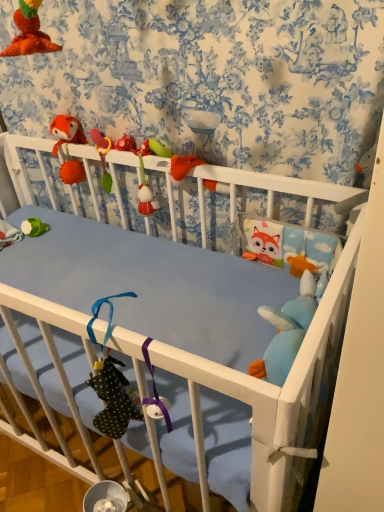
Measure the distance between soft plush toy at right, the 1th toy positioned from the bottom, and camera.

The depth of soft plush toy at right, the 1th toy positioned from the bottom, is 99.75 centimeters.

The height and width of the screenshot is (512, 384). I want to click on soft plush toy at right, the second toy viewed from the left, so click(x=309, y=271).

What do you see at coordinates (309, 271) in the screenshot? I see `soft plush toy at right, which is the first toy from front to back` at bounding box center [309, 271].

I want to click on fluffy orange fox at upper left, the 2th toy from the front, so click(66, 131).

Measure the distance between point (52, 131) and camera.

A distance of 1.32 meters exists between point (52, 131) and camera.

What do you see at coordinates (66, 131) in the screenshot? I see `fluffy orange fox at upper left, which is counted as the second toy, starting from the right` at bounding box center [66, 131].

At what (x,y) coordinates should I click in order to perform the action: click on soft plush toy at right, the 1th toy positioned from the bottom. Please return your answer as a coordinate pair (x, y). The image size is (384, 512). Looking at the image, I should click on (309, 271).

Is soft plush toy at right, which is the first toy from front to back, to the right of fluffy orange fox at upper left, positioned as the 1th toy in left-to-right order, from the viewer's perspective?

Yes.

Which object is closer to the camera taking this photo, soft plush toy at right, the 1th toy positioned from the bottom, or fluffy orange fox at upper left, the 2th toy from the front?

Positioned in front is soft plush toy at right, the 1th toy positioned from the bottom.

Which is nearer, (313, 276) or (60, 177)?

Point (313, 276) is positioned closer to the camera compared to point (60, 177).

From the image's perspective, does soft plush toy at right, which ranks as the 2th toy in top-to-bottom order, appear lower than fluffy orange fox at upper left, the 2th toy from the front?

Yes, from the image's perspective, soft plush toy at right, which ranks as the 2th toy in top-to-bottom order, is below fluffy orange fox at upper left, the 2th toy from the front.

From a real-world perspective, is soft plush toy at right, which is the first toy from front to back, under fluffy orange fox at upper left, the first toy positioned from the back?

Correct, in the physical world, soft plush toy at right, which is the first toy from front to back, is lower than fluffy orange fox at upper left, the first toy positioned from the back.

Which object is thinner, soft plush toy at right, which is the first toy from front to back, or fluffy orange fox at upper left, the 2th toy from the front?

fluffy orange fox at upper left, the 2th toy from the front, is thinner.

Can you confirm if soft plush toy at right, which ranks as the 2th toy in top-to-bottom order, is taller than fluffy orange fox at upper left, the 1th toy when ordered from top to bottom?

No, soft plush toy at right, which ranks as the 2th toy in top-to-bottom order, is not taller than fluffy orange fox at upper left, the 1th toy when ordered from top to bottom.

Who is smaller, soft plush toy at right, the 1th toy in the right-to-left sequence, or fluffy orange fox at upper left, positioned as the second toy in bottom-to-top order?

With smaller size is soft plush toy at right, the 1th toy in the right-to-left sequence.

Is soft plush toy at right, the 1th toy positioned from the bottom, outside of fluffy orange fox at upper left, positioned as the second toy in bottom-to-top order?

soft plush toy at right, the 1th toy positioned from the bottom, is positioned outside fluffy orange fox at upper left, positioned as the second toy in bottom-to-top order.

Is soft plush toy at right, the 1th toy in the right-to-left sequence, placed right next to fluffy orange fox at upper left, the 1th toy when ordered from top to bottom?

They are not placed beside each other.

Is soft plush toy at right, the 1th toy positioned from the bottom, positioned with its back to fluffy orange fox at upper left, the 2th toy from the front?

soft plush toy at right, the 1th toy positioned from the bottom, is not turned away from fluffy orange fox at upper left, the 2th toy from the front.

What's the angular difference between soft plush toy at right, placed as the second toy when sorted from back to front, and fluffy orange fox at upper left, the 2th toy from the front,'s facing directions?

soft plush toy at right, placed as the second toy when sorted from back to front, and fluffy orange fox at upper left, the 2th toy from the front, are facing 90.2 degrees away from each other.

How distant is soft plush toy at right, the 1th toy positioned from the bottom, from fluffy orange fox at upper left, the first toy positioned from the back?

The distance of soft plush toy at right, the 1th toy positioned from the bottom, from fluffy orange fox at upper left, the first toy positioned from the back, is 29.04 inches.

Find the location of a particular element. toy in front of the fluffy orange fox at upper left, positioned as the 1th toy in left-to-right order is located at coordinates (309, 271).

Which is more to the right, fluffy orange fox at upper left, positioned as the second toy in bottom-to-top order, or soft plush toy at right, the second toy viewed from the left?

soft plush toy at right, the second toy viewed from the left, is more to the right.

Is fluffy orange fox at upper left, the 2th toy from the front, further to the viewer compared to soft plush toy at right, placed as the second toy when sorted from back to front?

Yes, fluffy orange fox at upper left, the 2th toy from the front, is further from the camera.

Is point (60, 167) less distant than point (297, 255)?

That is False.

From the image's perspective, is fluffy orange fox at upper left, positioned as the second toy in bottom-to-top order, below soft plush toy at right, which is the first toy from front to back?

Incorrect, from the image's perspective, fluffy orange fox at upper left, positioned as the second toy in bottom-to-top order, is higher than soft plush toy at right, which is the first toy from front to back.

From a real-world perspective, is fluffy orange fox at upper left, the 1th toy when ordered from top to bottom, above or below soft plush toy at right, the second toy viewed from the left?

In terms of real-world spatial position, fluffy orange fox at upper left, the 1th toy when ordered from top to bottom, is above soft plush toy at right, the second toy viewed from the left.

Is fluffy orange fox at upper left, positioned as the second toy in bottom-to-top order, thinner than soft plush toy at right, which ranks as the 2th toy in top-to-bottom order?

Correct, the width of fluffy orange fox at upper left, positioned as the second toy in bottom-to-top order, is less than that of soft plush toy at right, which ranks as the 2th toy in top-to-bottom order.

Considering the sizes of objects fluffy orange fox at upper left, which is counted as the second toy, starting from the right, and soft plush toy at right, which is the first toy from front to back, in the image provided, who is taller, fluffy orange fox at upper left, which is counted as the second toy, starting from the right, or soft plush toy at right, which is the first toy from front to back,?

Standing taller between the two is fluffy orange fox at upper left, which is counted as the second toy, starting from the right.

Considering the relative sizes of fluffy orange fox at upper left, the first toy positioned from the back, and soft plush toy at right, which ranks as the 2th toy in top-to-bottom order, in the image provided, is fluffy orange fox at upper left, the first toy positioned from the back, smaller than soft plush toy at right, which ranks as the 2th toy in top-to-bottom order,?

Actually, fluffy orange fox at upper left, the first toy positioned from the back, might be larger than soft plush toy at right, which ranks as the 2th toy in top-to-bottom order.

Is fluffy orange fox at upper left, positioned as the 1th toy in left-to-right order, inside the boundaries of soft plush toy at right, which ranks as the 2th toy in top-to-bottom order, or outside?

fluffy orange fox at upper left, positioned as the 1th toy in left-to-right order, is not enclosed by soft plush toy at right, which ranks as the 2th toy in top-to-bottom order.

Consider the image. Is fluffy orange fox at upper left, the 1th toy when ordered from top to bottom, next to soft plush toy at right, the 1th toy positioned from the bottom, and touching it?

fluffy orange fox at upper left, the 1th toy when ordered from top to bottom, and soft plush toy at right, the 1th toy positioned from the bottom, are clearly separated.

Could you tell me if fluffy orange fox at upper left, positioned as the 1th toy in left-to-right order, is facing soft plush toy at right, the 1th toy positioned from the bottom?

No, fluffy orange fox at upper left, positioned as the 1th toy in left-to-right order, does not turn towards soft plush toy at right, the 1th toy positioned from the bottom.

You are a GUI agent. You are given a task and a screenshot of the screen. Output one action in this format:
    pyautogui.click(x=<x>, y=<y>)
    Task: Click on the toy lying above the soft plush toy at right, the 1th toy positioned from the bottom (from the image's perspective)
    The image size is (384, 512).
    Given the screenshot: What is the action you would take?
    pyautogui.click(x=66, y=131)

Image resolution: width=384 pixels, height=512 pixels. I want to click on toy located in front of the fluffy orange fox at upper left, the 2th toy from the front, so click(309, 271).

Image resolution: width=384 pixels, height=512 pixels. Identify the location of toy above the soft plush toy at right, the 1th toy positioned from the bottom (from a real-world perspective). [x=66, y=131].